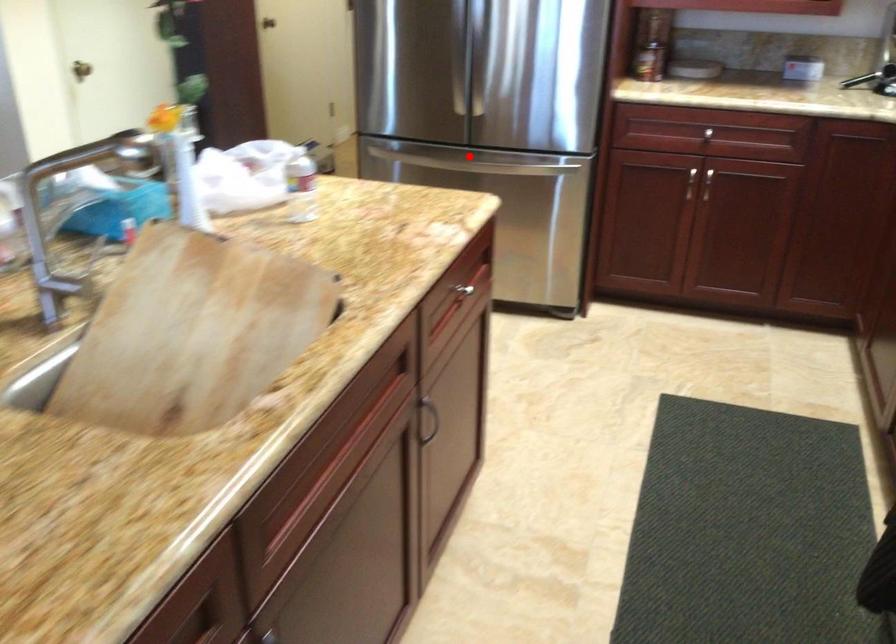
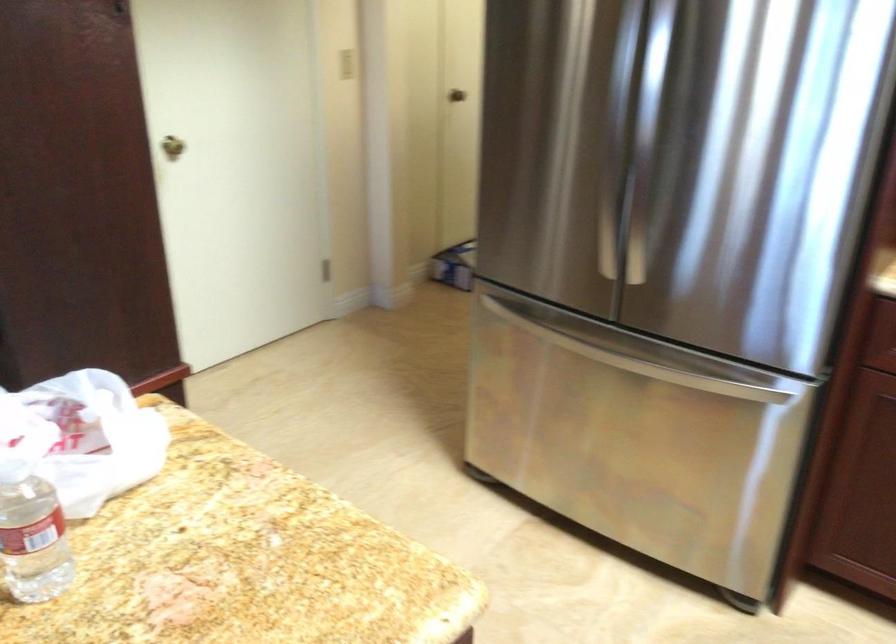
Question: I am providing you with two images of the same scene from different viewpoints. Given a red point in image1, look at the same physical point in image2. Is it:

Choices:
 (A) Closer to the viewpoint
 (B) Farther from the viewpoint

Answer: (A)